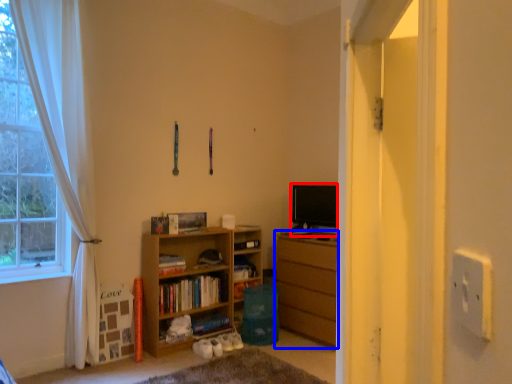
Question: Among these objects, which one is farthest to the camera, level (highlighted by a red box) or chest of drawers (highlighted by a blue box)?

Choices:
 (A) level
 (B) chest of drawers

Answer: (A)